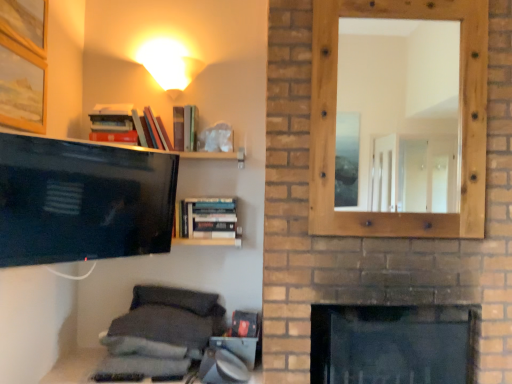
Question: Considering the relative positions of matte white cone at upper center and gray fabric pillow at lower center, which ranks as the second pillow in bottom-to-top order, in the image provided, is matte white cone at upper center to the right of gray fabric pillow at lower center, which ranks as the second pillow in bottom-to-top order, from the viewer's perspective?

Choices:
 (A) no
 (B) yes

Answer: (B)

Question: Is matte white cone at upper center at the left side of gray fabric pillow at lower center, which ranks as the second pillow in bottom-to-top order?

Choices:
 (A) yes
 (B) no

Answer: (B)

Question: Does matte white cone at upper center have a lesser height compared to gray fabric pillow at lower center, which ranks as the second pillow in bottom-to-top order?

Choices:
 (A) no
 (B) yes

Answer: (A)

Question: From a real-world perspective, is matte white cone at upper center physically below gray fabric pillow at lower center, which ranks as the second pillow in bottom-to-top order?

Choices:
 (A) yes
 (B) no

Answer: (B)

Question: Is matte white cone at upper center thinner than gray fabric pillow at lower center, the 2th pillow from the top?

Choices:
 (A) no
 (B) yes

Answer: (B)

Question: Looking at their shapes, would you say matte black tv at left is wider or thinner than matte white cone at upper center?

Choices:
 (A) wide
 (B) thin

Answer: (B)

Question: Does point (100, 160) appear closer or farther from the camera than point (164, 44)?

Choices:
 (A) closer
 (B) farther

Answer: (A)

Question: Is matte black tv at left bigger or smaller than matte white cone at upper center?

Choices:
 (A) small
 (B) big

Answer: (B)

Question: Relative to matte white cone at upper center, is matte black tv at left in front or behind?

Choices:
 (A) behind
 (B) front

Answer: (B)

Question: From a real-world perspective, relative to wooden picture frame at upper left, arranged as the second picture frame when ordered from the bottom, is matte white cone at upper center vertically above or below?

Choices:
 (A) below
 (B) above

Answer: (A)

Question: Is matte white cone at upper center inside or outside of wooden picture frame at upper left, the first picture frame when ordered from top to bottom?

Choices:
 (A) outside
 (B) inside

Answer: (A)

Question: From the image's perspective, is matte white cone at upper center above or below wooden picture frame at upper left, arranged as the second picture frame when ordered from the bottom?

Choices:
 (A) above
 (B) below

Answer: (B)

Question: Considering the positions of matte white cone at upper center and wooden picture frame at upper left, arranged as the second picture frame when ordered from the bottom, in the image, is matte white cone at upper center wider or thinner than wooden picture frame at upper left, arranged as the second picture frame when ordered from the bottom,?

Choices:
 (A) thin
 (B) wide

Answer: (B)

Question: From a real-world perspective, is dark gray fabric pillow at lower center, marked as the third pillow in a bottom-to-top arrangement, above or below gray fabric pillow at lower center, which ranks as the 1th pillow in bottom-to-top order?

Choices:
 (A) above
 (B) below

Answer: (A)

Question: Would you say dark gray fabric pillow at lower center, arranged as the first pillow when viewed from the top, is inside or outside gray fabric pillow at lower center, which appears as the third pillow when viewed from the top?

Choices:
 (A) outside
 (B) inside

Answer: (A)